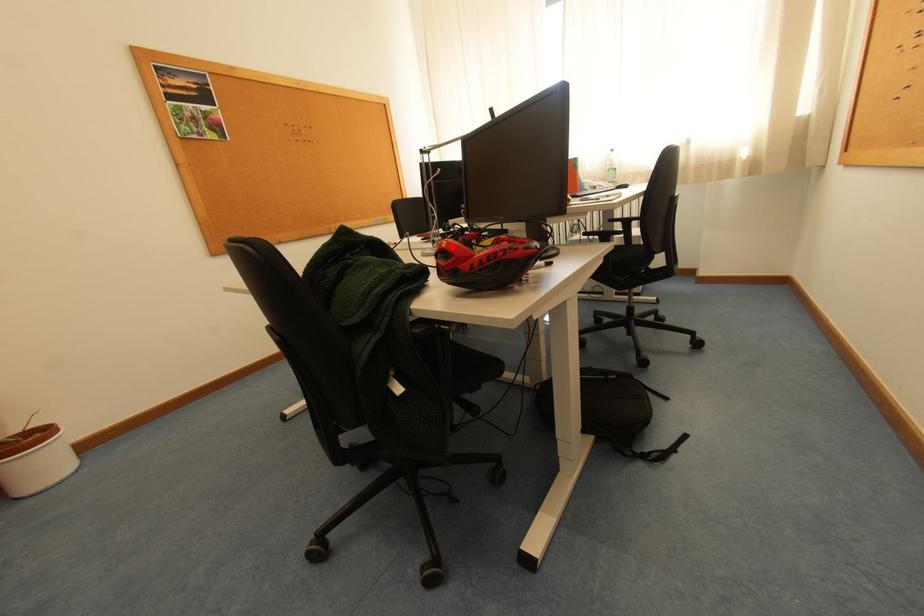
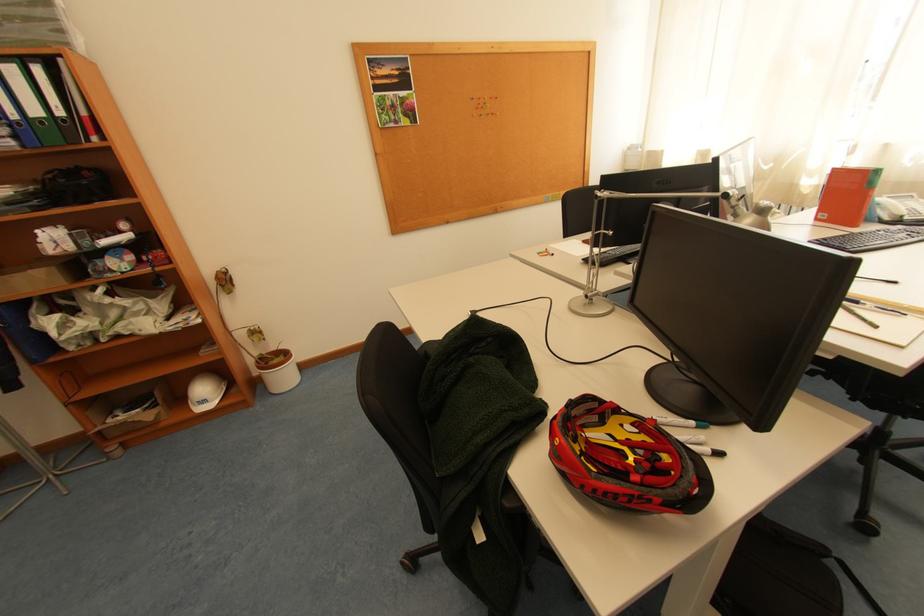
Where in the second image is the point corresponding to the highlighted location from the first image?

(565, 445)